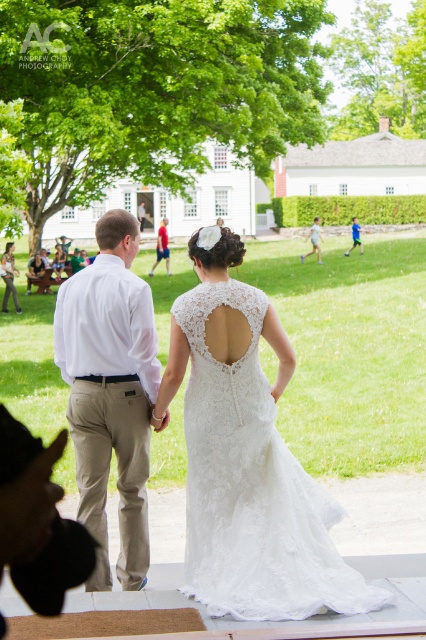
Question: Which of the following is the closest to the observer?

Choices:
 (A) lace/embroidered dress at center
 (B) white lace dress at center

Answer: (A)

Question: Is white cotton shirt at center bigger than matte white dress at center?

Choices:
 (A) yes
 (B) no

Answer: (B)

Question: Can you confirm if lace/embroidered dress at center is positioned below blue cotton shirt at center?

Choices:
 (A) yes
 (B) no

Answer: (A)

Question: Considering the real-world distances, which object is closest to the white cotton shirt at center?

Choices:
 (A) matte white dress at center
 (B) white lace dress at center
 (C) blue cotton shirt at center
 (D) lace/embroidered dress at center

Answer: (D)

Question: Based on their relative distances, which object is nearer to the blue cotton shirt at center?

Choices:
 (A) white cotton shirt at center
 (B) lace/embroidered dress at center

Answer: (A)

Question: Is white cotton shirt at center behind blue cotton shirt at center?

Choices:
 (A) no
 (B) yes

Answer: (A)